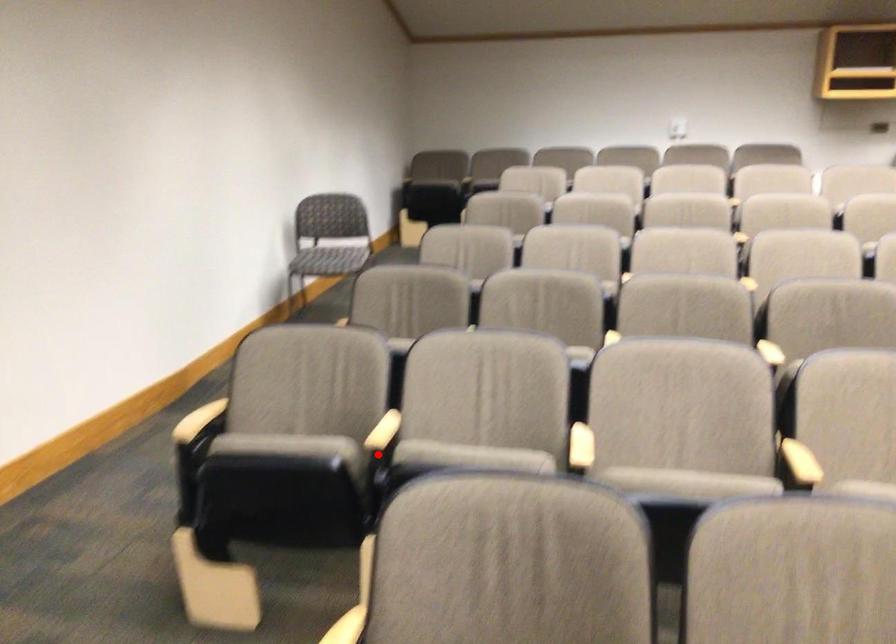
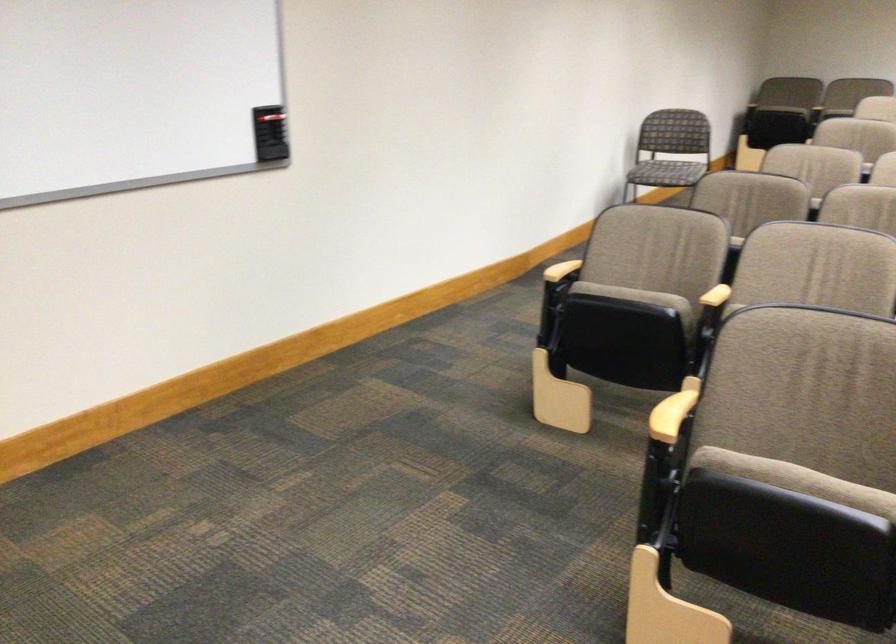
Question: I am providing you with two images of the same scene from different viewpoints. Image1 has a red point marked. In image2, the corresponding 3D location appears at what relative position? Reply with the corresponding letter.

Choices:
 (A) Closer
 (B) Farther

Answer: (B)